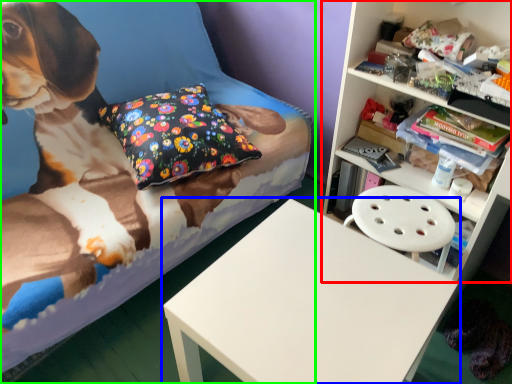
Question: Based on their relative distances, which object is nearer to shelf (highlighted by a red box)? Choose from table (highlighted by a blue box) and bed (highlighted by a green box).

Choices:
 (A) table
 (B) bed

Answer: (A)